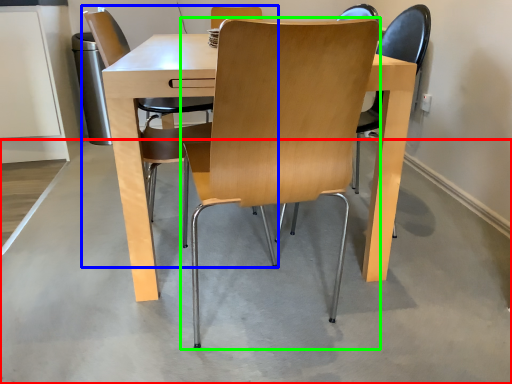
Question: Estimate the real-world distances between objects in this image. Which object is closer to concrete (highlighted by a red box), chair (highlighted by a blue box) or chair (highlighted by a green box)?

Choices:
 (A) chair
 (B) chair

Answer: (B)